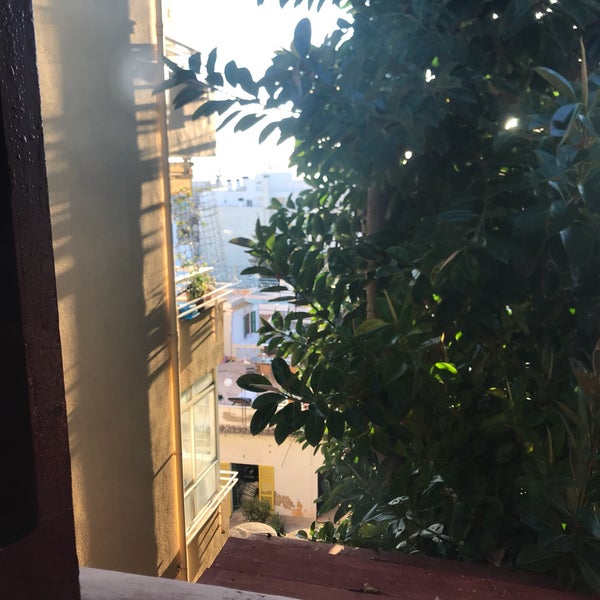
Find the location of a particular element. This screenshot has width=600, height=600. potted plants is located at coordinates (188, 289), (201, 289).